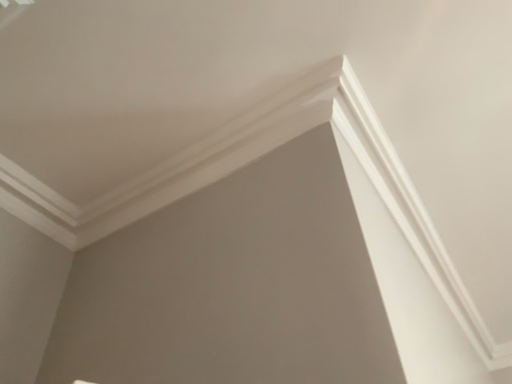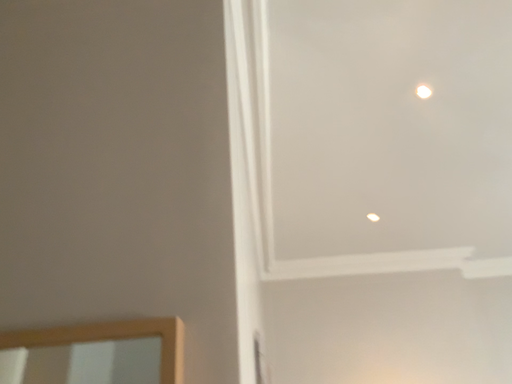
Question: How did the camera likely rotate when shooting the video?

Choices:
 (A) rotated left
 (B) rotated right

Answer: (B)